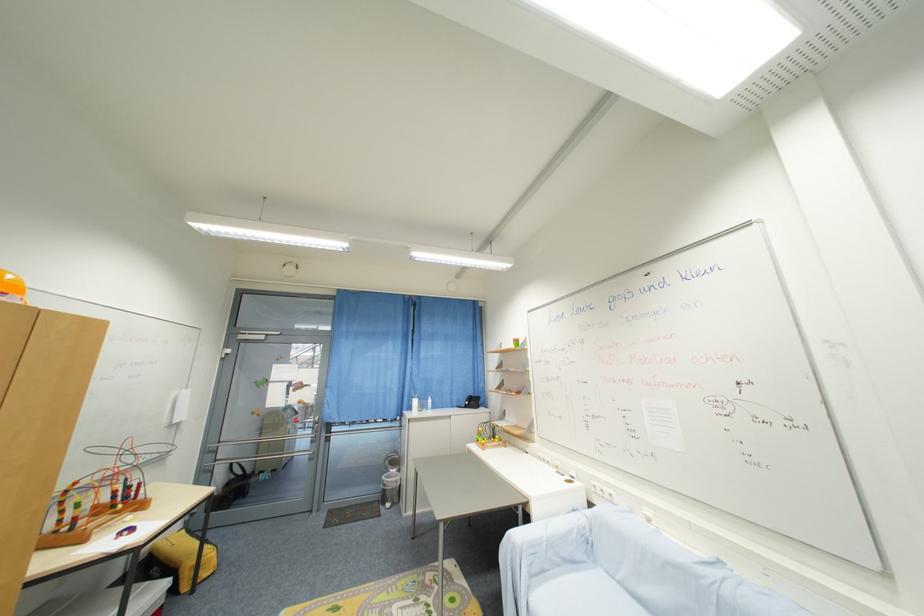
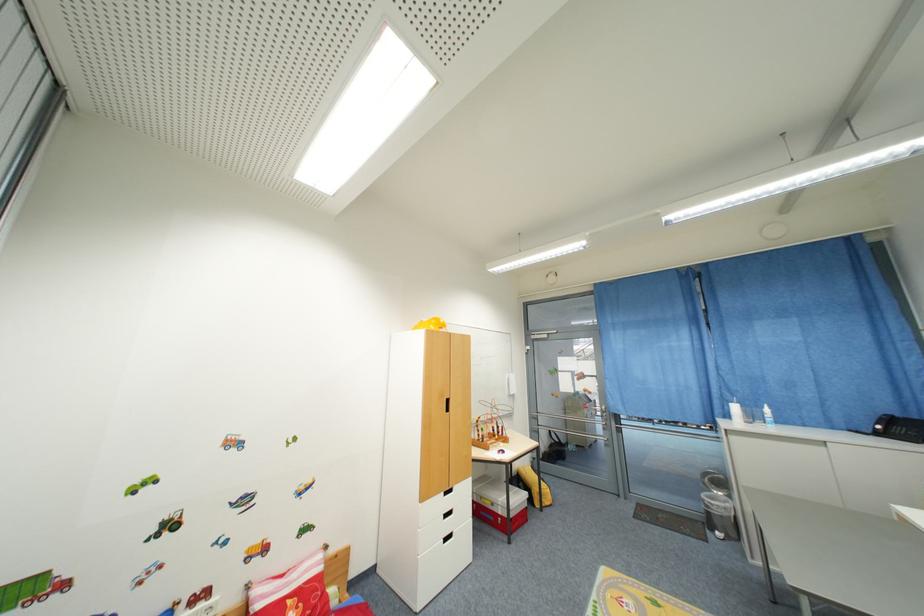
Locate, in the second image, the point that corresponds to the point at 118,508 in the first image.

(500, 438)